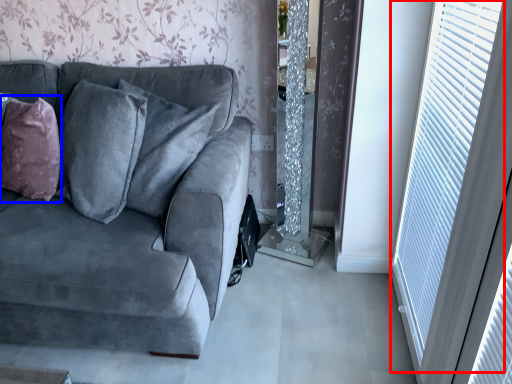
Question: Which object is further to the camera taking this photo, window (highlighted by a red box) or throw pillow (highlighted by a blue box)?

Choices:
 (A) window
 (B) throw pillow

Answer: (B)